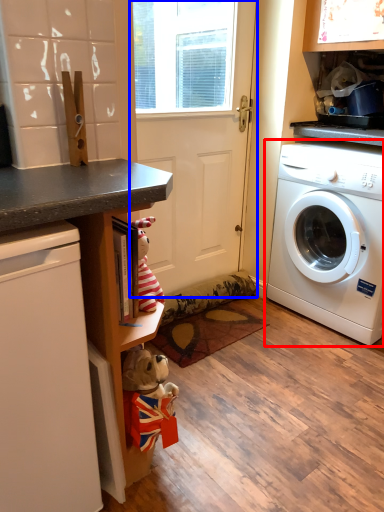
Question: Which object appears farthest to the camera in this image, washing machine (highlighted by a red box) or screen door (highlighted by a blue box)?

Choices:
 (A) washing machine
 (B) screen door

Answer: (B)